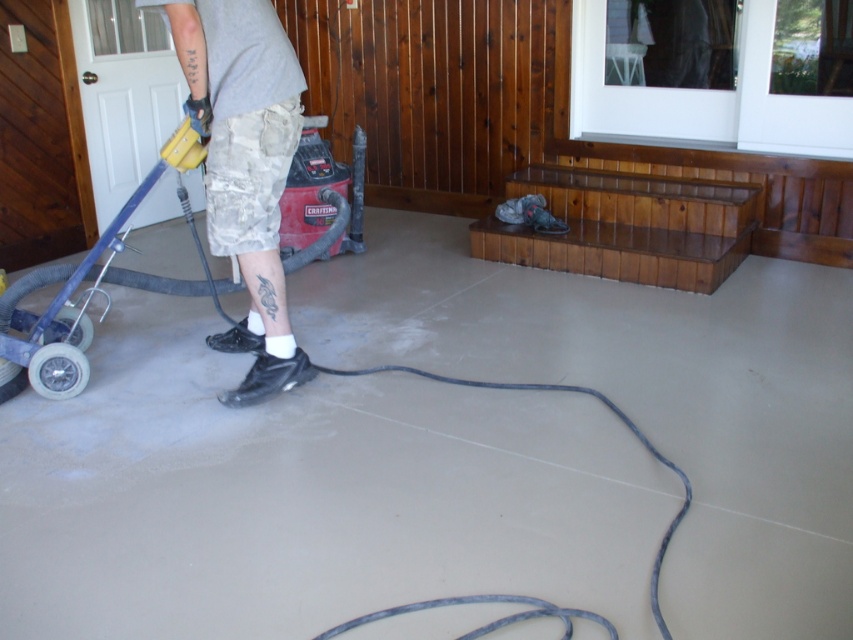
Which is above, smooth concrete floor at center or camouflage shorts at left?

camouflage shorts at left is above.

Can you confirm if smooth concrete floor at center is thinner than camouflage shorts at left?

No.

Locate an element on the screen. The image size is (853, 640). smooth concrete floor at center is located at coordinates (305, 496).